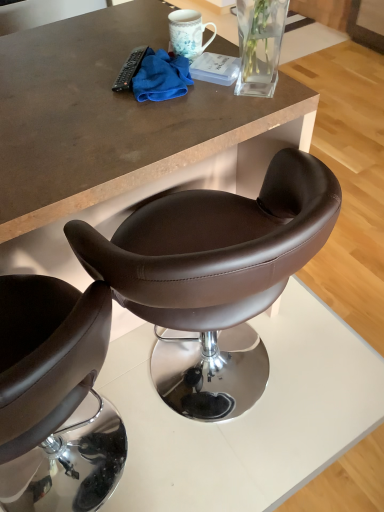
Find the location of a particular element. vacant space that is to the left of blue microfiber cloth at upper center is located at coordinates (86, 91).